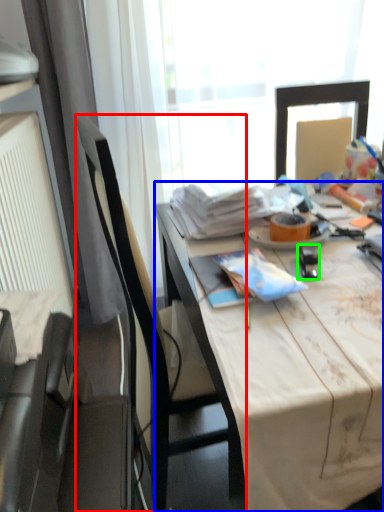
Question: Which is nearer to the chair (highlighted by a red box)? desk (highlighted by a blue box) or stationery (highlighted by a green box).

Choices:
 (A) desk
 (B) stationery

Answer: (A)